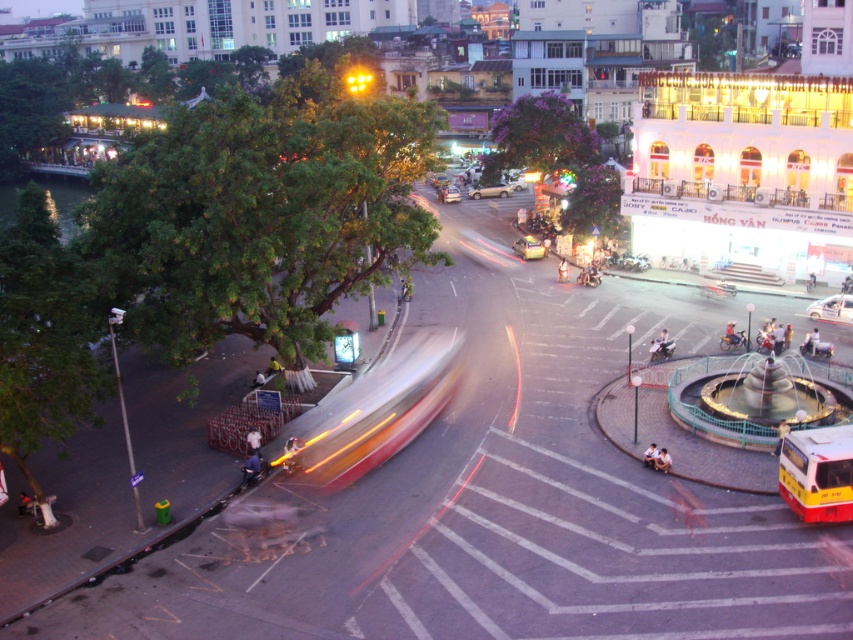
You are standing at the intersection and want to reach a specific point marked at coordinates point (836,321). If your walking speed is 1.5 meters per second, how many seconds will it take you to reach that point?

The distance of point (836,321) from viewer is 48.10 meters. At a walking speed of 1.5 meters per second, it would take approximately 32 seconds to reach the point.

Based on the photo, you are a pedestrian waiting at the intersection. You see a metallic silver car at center and a gold metallic sedan at center. Which one is closer to the right side of the road?

The metallic silver car at center is closer to the right side of the road because it is positioned to the right of the gold metallic sedan at center.

You are a pedestrian standing at the intersection and want to cross the street. The yellow matte bus at lower right is approaching. Can you safely cross before the bus arrives if you walk at a normal pace?

The yellow matte bus at lower right is 27.22 meters away from you. Since it is approaching, you should wait for the bus to pass before crossing the street to ensure safety.